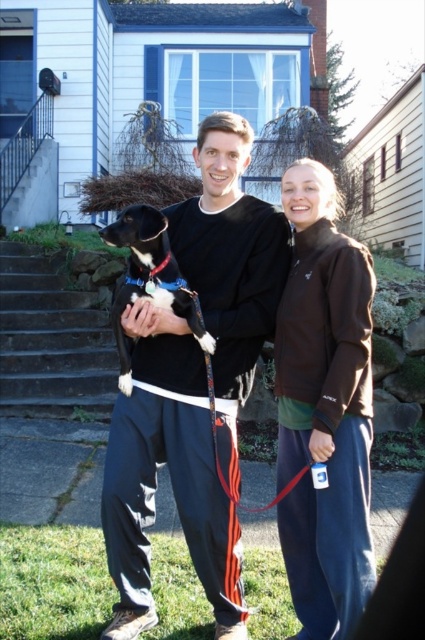
You are standing in the residential area and looking at the scene. Which object is positioned higher between the black matte dog at center and the matte brown jacket at center?

The black matte dog at center is positioned higher than the matte brown jacket at center according to the spatial relationship provided.

You are standing at the bottom of the concrete stairs at lower left and want to hand a package to the person wearing the matte brown jacket at center. Which direction should you move to reach them?

The matte brown jacket at center is closer to the viewer than the concrete stairs at lower left, so you should move forward towards the matte brown jacket at center to reach them.

You are standing at the origin point of the coordinate system. Based on the coordinates provided, which object is located at point (x=170, y=476)?

The black matte dog at center is located at point (x=170, y=476).